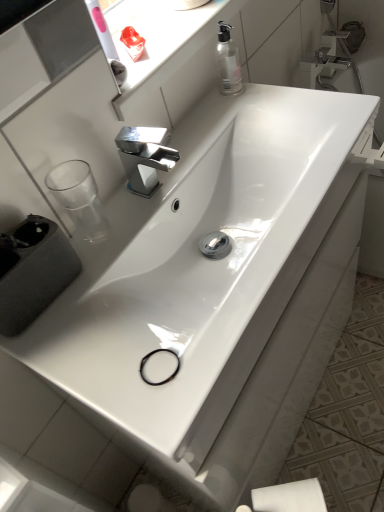
Image resolution: width=384 pixels, height=512 pixels. I want to click on free space to the left of transparent plastic soap dispenser at upper right, so click(x=196, y=113).